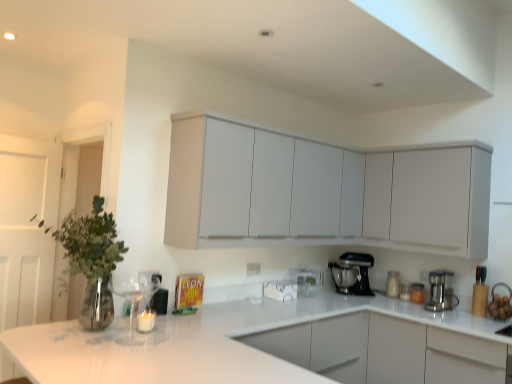
Question: From a real-world perspective, is satin silver coffee maker at right, the first kitchen appliance positioned from the front, positioned under white glossy sink at lower right based on gravity?

Choices:
 (A) no
 (B) yes

Answer: (A)

Question: Considering the relative sizes of satin silver coffee maker at right, which appears as the 2th kitchen appliance when viewed from the left, and white glossy sink at lower right in the image provided, is satin silver coffee maker at right, which appears as the 2th kitchen appliance when viewed from the left, bigger than white glossy sink at lower right?

Choices:
 (A) no
 (B) yes

Answer: (B)

Question: Is satin silver coffee maker at right, placed as the first kitchen appliance when sorted from right to left, smaller than white glossy sink at lower right?

Choices:
 (A) yes
 (B) no

Answer: (B)

Question: From the image's perspective, is satin silver coffee maker at right, the second kitchen appliance from the back, beneath white glossy sink at lower right?

Choices:
 (A) no
 (B) yes

Answer: (A)

Question: From the image's perspective, is satin silver coffee maker at right, which appears as the 2th kitchen appliance when viewed from the left, on white glossy sink at lower right?

Choices:
 (A) no
 (B) yes

Answer: (B)

Question: Visually, is black metallic stand mixer at lower center, which appears as the 2th kitchen appliance when viewed from the right, positioned to the left or to the right of white glossy sink at lower right?

Choices:
 (A) right
 (B) left

Answer: (B)

Question: Is black metallic stand mixer at lower center, which ranks as the first kitchen appliance in left-to-right order, in front of or behind white glossy sink at lower right in the image?

Choices:
 (A) behind
 (B) front

Answer: (A)

Question: From the image's perspective, is black metallic stand mixer at lower center, the second kitchen appliance from the front, above or below white glossy sink at lower right?

Choices:
 (A) below
 (B) above

Answer: (B)

Question: Considering the positions of point (367, 271) and point (502, 319), is point (367, 271) closer or farther from the camera than point (502, 319)?

Choices:
 (A) closer
 (B) farther

Answer: (B)

Question: Is matte white cabinets at upper center, placed as the 1th cabinetry when sorted from left to right, spatially inside white wooden door at left, or outside of it?

Choices:
 (A) outside
 (B) inside

Answer: (A)

Question: From their relative heights in the image, would you say matte white cabinets at upper center, placed as the 1th cabinetry when sorted from left to right, is taller or shorter than white wooden door at left?

Choices:
 (A) tall
 (B) short

Answer: (B)

Question: Is matte white cabinets at upper center, placed as the 1th cabinetry when sorted from left to right, bigger or smaller than white wooden door at left?

Choices:
 (A) small
 (B) big

Answer: (B)

Question: Relative to white wooden door at left, is matte white cabinets at upper center, the second cabinetry from the right, in front or behind?

Choices:
 (A) front
 (B) behind

Answer: (A)

Question: Considering the positions of point (0, 274) and point (387, 286), is point (0, 274) closer or farther from the camera than point (387, 286)?

Choices:
 (A) farther
 (B) closer

Answer: (B)

Question: Would you say white wooden door at left is inside or outside white glossy jar at lower right?

Choices:
 (A) inside
 (B) outside

Answer: (B)